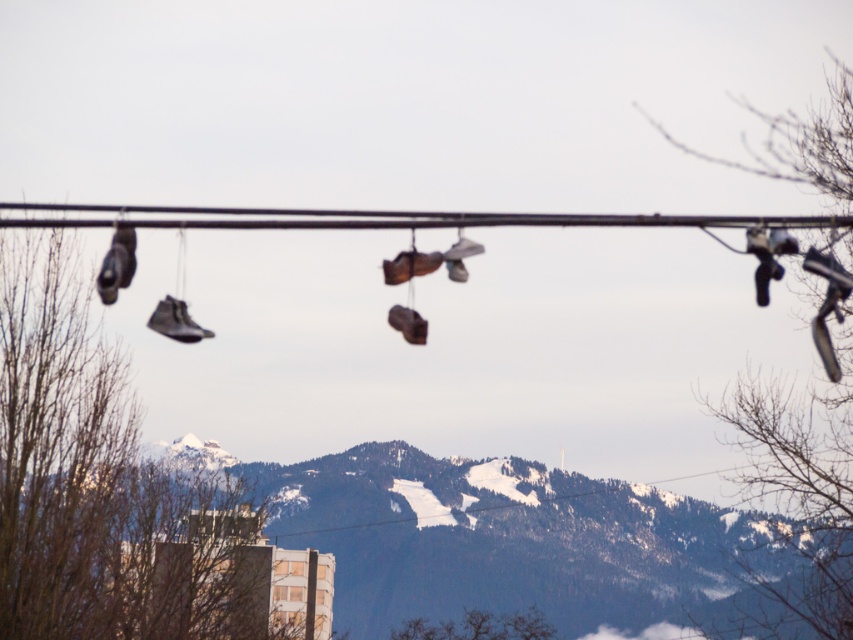
You are an artist planning to paint the scene with the matte black shoe at left and the matte black sneaker at center. Which object should you paint taller in your artwork to accurately represent their sizes as shown in the image?

The matte black shoe at left should be painted taller than the matte black sneaker at center because it has a greater height compared to the matte black sneaker at center.

You are a hiker planning to cross a mountain pass and notice the matte black shoe at left hanging from a wire. If the distance between you and the shoe is 303.21 meters, can you safely walk under the wire without the shoe falling on you?

The distance between you and the matte black shoe at left is 303.21 meters, so you can safely walk under the wire without the shoe falling on you because the distance is too large for it to reach you.

You are an artist planning to paint the snowy forested mountain at center and the matte black sneaker at center in the scene. Which object should you focus on first if you want to paint the larger one first?

The snowy forested mountain at center has a larger size compared to the matte black sneaker at center, so you should focus on painting the snowy forested mountain at center first.